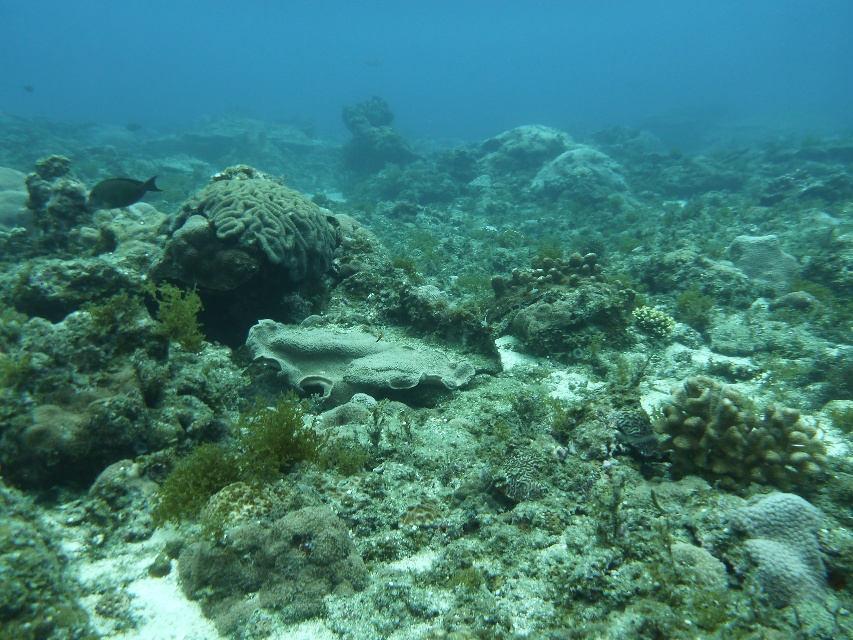
You are a marine biologist studying underwater ecosystems. You need to place a 30 inch measuring tape between the green matte algae at center and the gray porous coral at center. Will the tape be long enough to reach both ends?

The green matte algae at center is 27.24 inches from the gray porous coral at center. Since the measuring tape is 30 inches long, it will be long enough to reach both ends.

You are a diver who needs to locate the brown coral at lower right. According to the coordinates provided, where exactly is it positioned in the image?

The brown coral at lower right is located at the 2D coordinates point (737, 436) in the image.